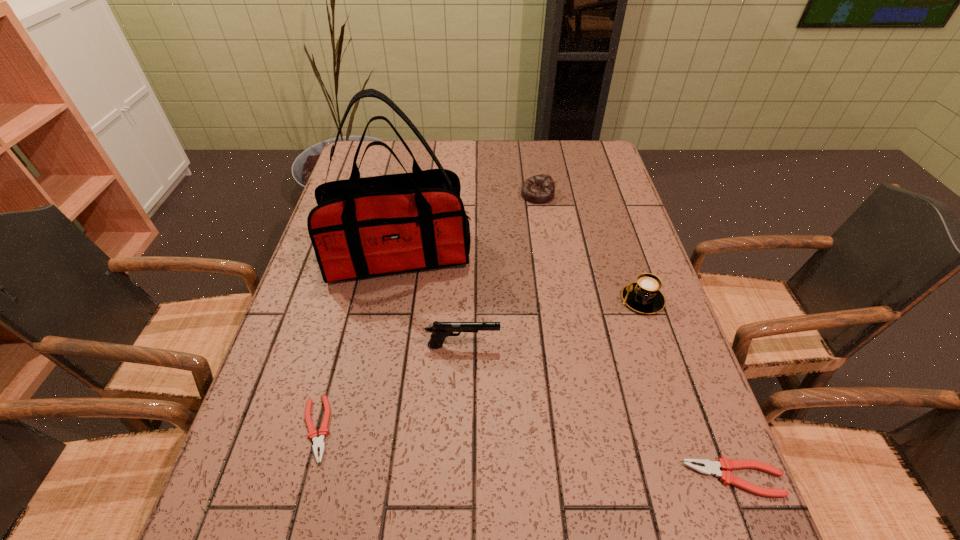
To achieve uniform spacing by inserting another pliers among them, please point to a free space for this new pliers. Please provide its 2D coordinates. Your answer should be formatted as a tuple, i.e. [(x, y)], where the tuple contains the x and y coordinates of a point satisfying the conditions above.

[(516, 453)]